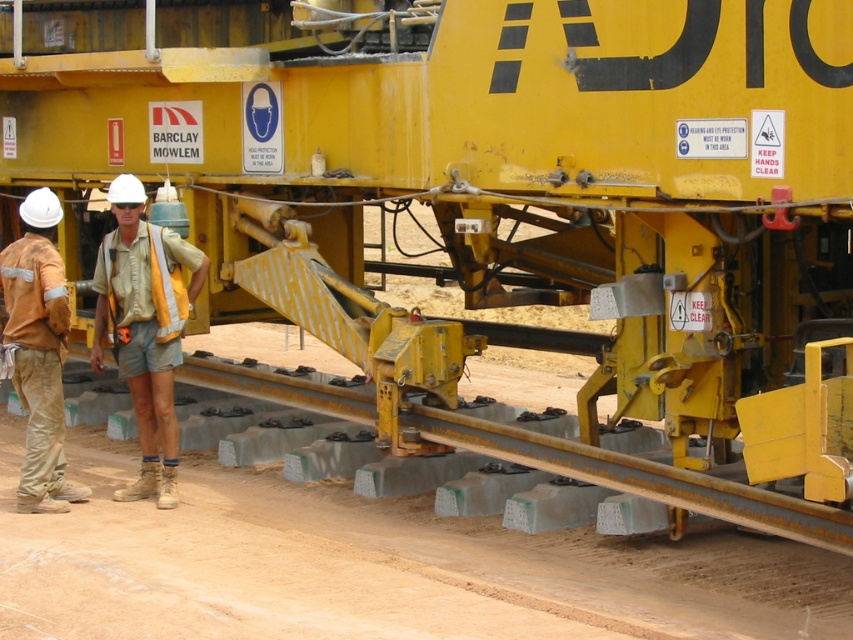
Looking at this image, which of these two, camouflage fabric shirt at center or orange fabric pants at left, stands taller?

camouflage fabric shirt at center

Which is more to the right, camouflage fabric shirt at center or orange fabric pants at left?

Positioned to the right is camouflage fabric shirt at center.

Does point (163, 275) come behind point (61, 404)?

No, it is in front of (61, 404).

Locate an element on the screen. The height and width of the screenshot is (640, 853). camouflage fabric shirt at center is located at coordinates (144, 328).